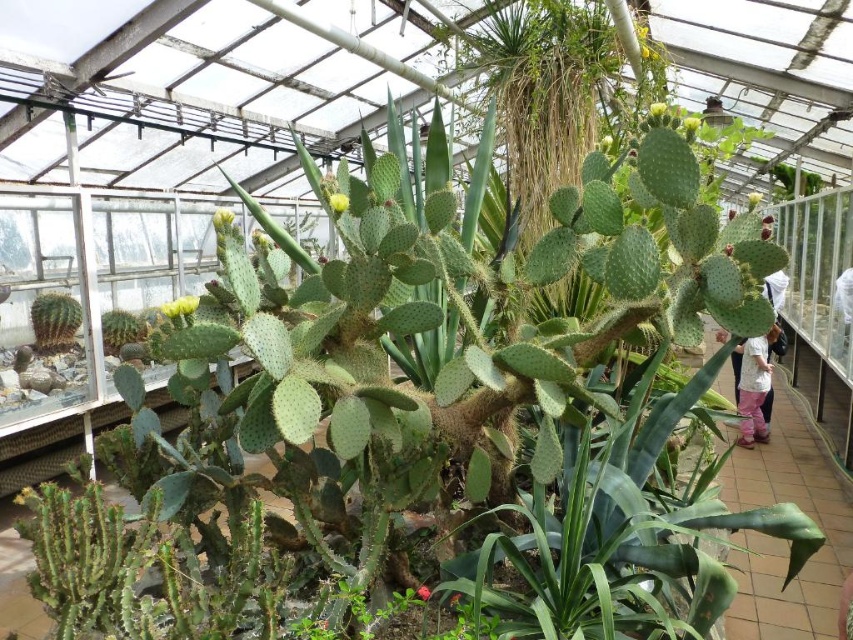
Between white cotton shirt at right and smooth golden cactus at lower left, which one appears on the left side from the viewer's perspective?

smooth golden cactus at lower left

Identify the location of white cotton shirt at right. click(x=753, y=387).

Identify the location of white cotton shirt at right. The height and width of the screenshot is (640, 853). (753, 387).

Locate an element on the screen. white cotton shirt at right is located at coordinates (753, 387).